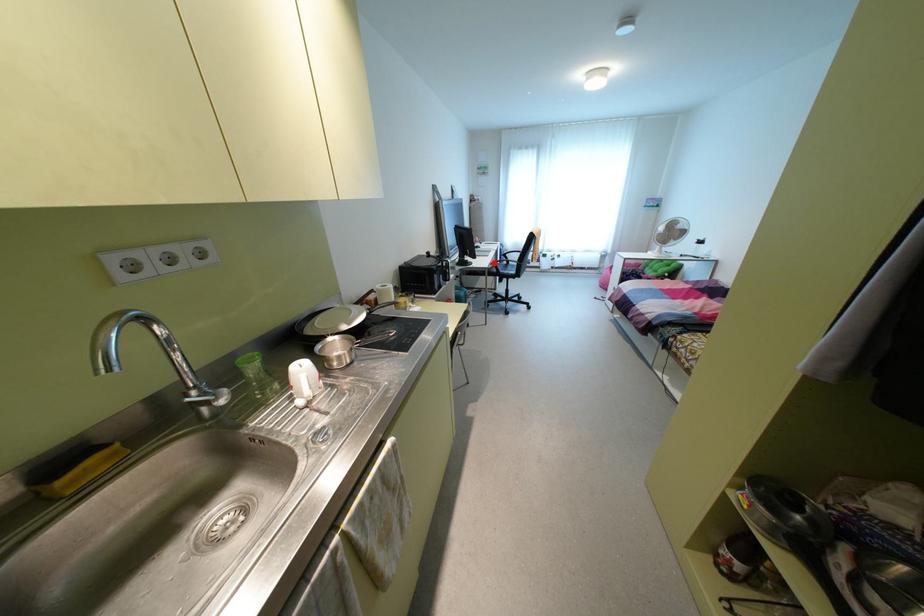
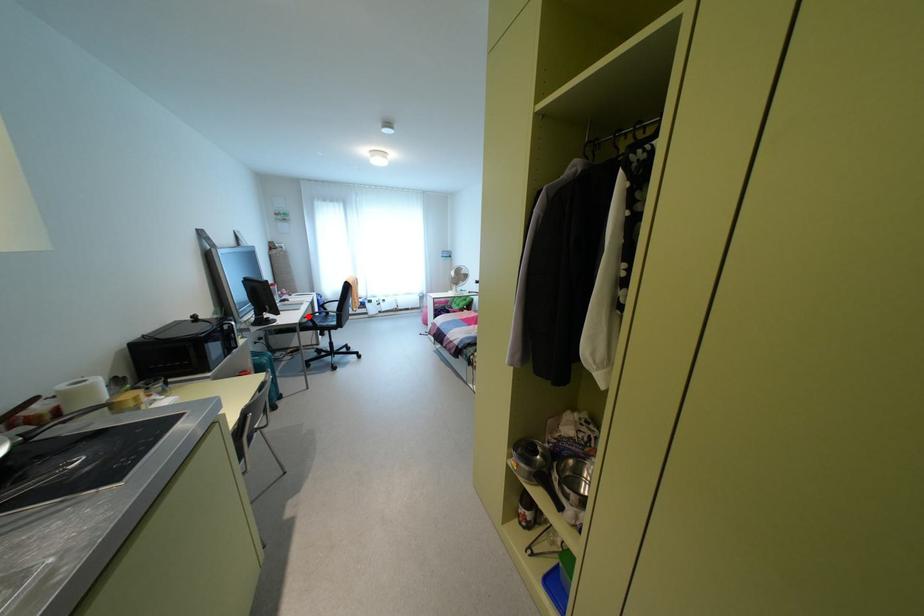
I am providing you with two images of the same scene from different viewpoints. A red point is marked on the first image and another point is marked on the second image. Does the point marked in image1 correspond to the same location as the one in image2?

Yes